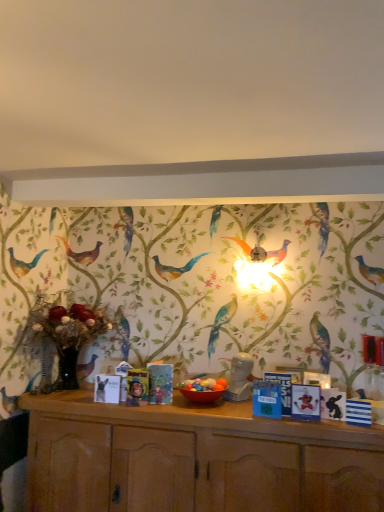
This screenshot has width=384, height=512. Identify the location of wooden cabinet at center. (194, 459).

What do you see at coordinates (194, 459) in the screenshot? I see `wooden cabinet at center` at bounding box center [194, 459].

Find the location of a particular element. The width and height of the screenshot is (384, 512). wooden cabinet at center is located at coordinates (194, 459).